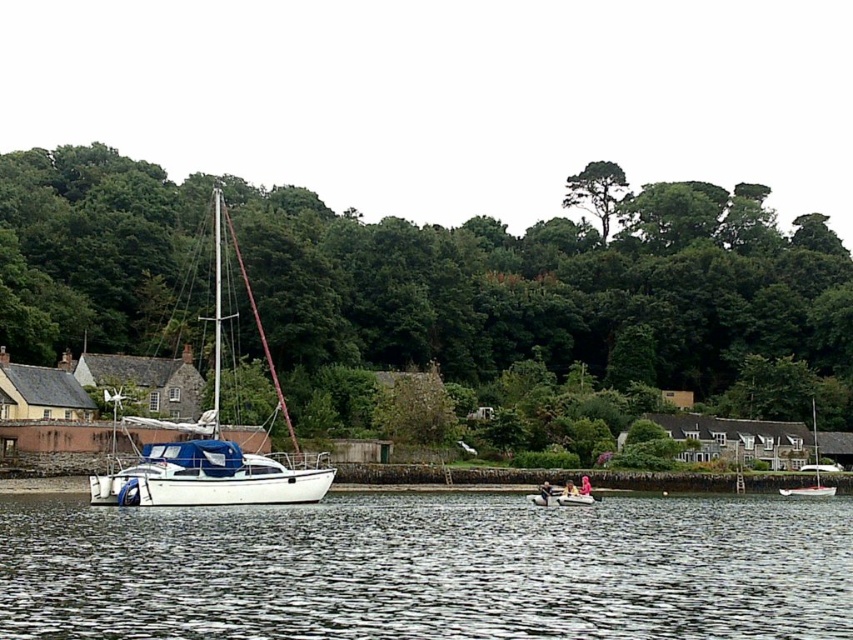
Which is more to the left, clear water at center or white plastic kayak at center?

From the viewer's perspective, clear water at center appears more on the left side.

Does clear water at center come behind white plastic kayak at center?

No, it is in front of white plastic kayak at center.

Is point (376, 557) positioned after point (535, 493)?

No, it is not.

Locate an element on the screen. clear water at center is located at coordinates (428, 568).

Where is `white glossy sailboat at right`? The width and height of the screenshot is (853, 640). white glossy sailboat at right is located at coordinates (811, 468).

Can you confirm if green leafy tree at center is positioned below clear water at center?

No, green leafy tree at center is not below clear water at center.

Is green leafy tree at center behind clear water at center?

Yes, green leafy tree at center is further from the viewer.

The height and width of the screenshot is (640, 853). I want to click on green leafy tree at center, so click(x=426, y=276).

Identify the location of green leafy tree at center. (426, 276).